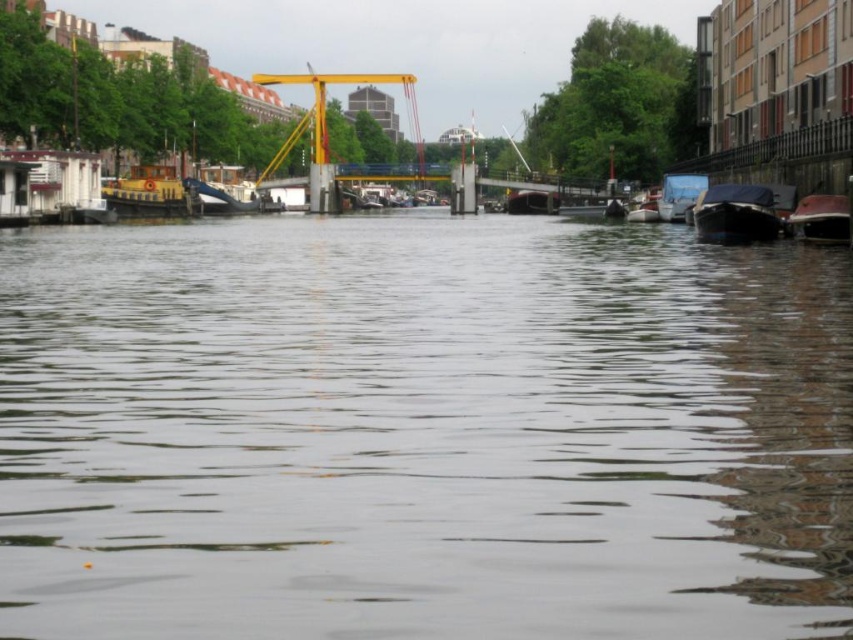
Who is higher up, transparent water at center or metallic silver boat at center?

metallic silver boat at center is above.

Is transparent water at center smaller than metallic silver boat at center?

No.

Between point (221, 412) and point (636, 212), which one is positioned behind?

The point (636, 212) is more distant.

At what (x,y) coordinates should I click in order to perform the action: click on transparent water at center. Please return your answer as a coordinate pair (x, y). The image size is (853, 640). Looking at the image, I should click on (422, 429).

Is shiny red boat at right further to the viewer compared to blue tarpaulin boat at right?

No.

Which is above, shiny red boat at right or blue tarpaulin boat at right?

blue tarpaulin boat at right is above.

The width and height of the screenshot is (853, 640). What do you see at coordinates (820, 218) in the screenshot? I see `shiny red boat at right` at bounding box center [820, 218].

This screenshot has height=640, width=853. Identify the location of shiny red boat at right. (820, 218).

Does dark blue tarp at right have a lesser width compared to blue tarpaulin boat at right?

Incorrect, dark blue tarp at right's width is not less than blue tarpaulin boat at right's.

Can you confirm if dark blue tarp at right is smaller than blue tarpaulin boat at right?

Actually, dark blue tarp at right might be larger than blue tarpaulin boat at right.

What do you see at coordinates (735, 212) in the screenshot?
I see `dark blue tarp at right` at bounding box center [735, 212].

The width and height of the screenshot is (853, 640). Find the location of `dark blue tarp at right`. dark blue tarp at right is located at coordinates (735, 212).